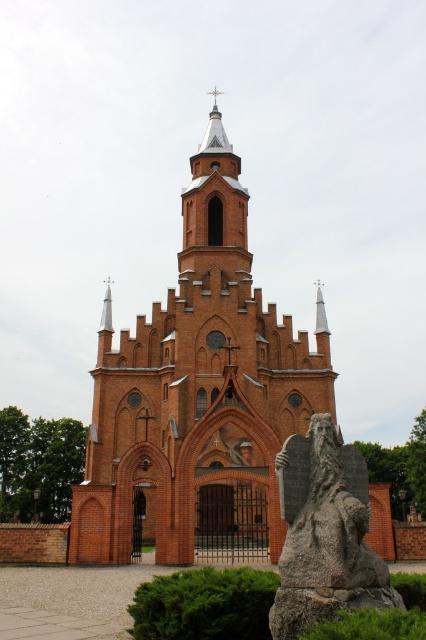
Based on the scene description, what is located at the coordinates point [198,394]?

The red brick church tower at center is located at point [198,394].

You are a photographer planning to capture the red brick church tower at center and the gray stone statue at lower right in a single shot. Based on their heights, which one should you focus on to ensure both are fully visible in the frame?

The red brick church tower at center is taller than the gray stone statue at lower right, so focusing on the tower will ensure both are fully visible in the frame.

You are a tour guide leading a group to the gray stone statue at lower right from the red brick church tower at center. The path is straight and clear. If your group walks at a speed of 3 feet per second, how many seconds will it take to reach the statue?

The distance between the red brick church tower at center and the gray stone statue at lower right is 128.68 feet. At a walking speed of 3 feet per second, the time required is 128.68 divided by 3, which equals approximately 42.89 seconds. Therefore, it will take about 43 seconds to reach the statue.